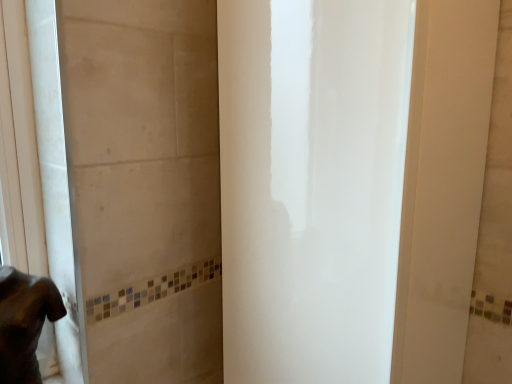
Question: Considering the relative positions of dark brown fur at lower left and white glossy screen door at center in the image provided, is dark brown fur at lower left to the left or to the right of white glossy screen door at center?

Choices:
 (A) right
 (B) left

Answer: (B)

Question: Considering the positions of point (7, 311) and point (230, 54), is point (7, 311) closer or farther from the camera than point (230, 54)?

Choices:
 (A) closer
 (B) farther

Answer: (A)

Question: Considering the positions of dark brown fur at lower left and white glossy screen door at center in the image, is dark brown fur at lower left wider or thinner than white glossy screen door at center?

Choices:
 (A) wide
 (B) thin

Answer: (B)

Question: Is white glossy screen door at center bigger or smaller than dark brown fur at lower left?

Choices:
 (A) small
 (B) big

Answer: (B)

Question: From a real-world perspective, is white glossy screen door at center above or below dark brown fur at lower left?

Choices:
 (A) above
 (B) below

Answer: (A)

Question: Does point (380, 110) appear closer or farther from the camera than point (11, 311)?

Choices:
 (A) closer
 (B) farther

Answer: (A)

Question: From the image's perspective, is white glossy screen door at center positioned above or below dark brown fur at lower left?

Choices:
 (A) above
 (B) below

Answer: (A)